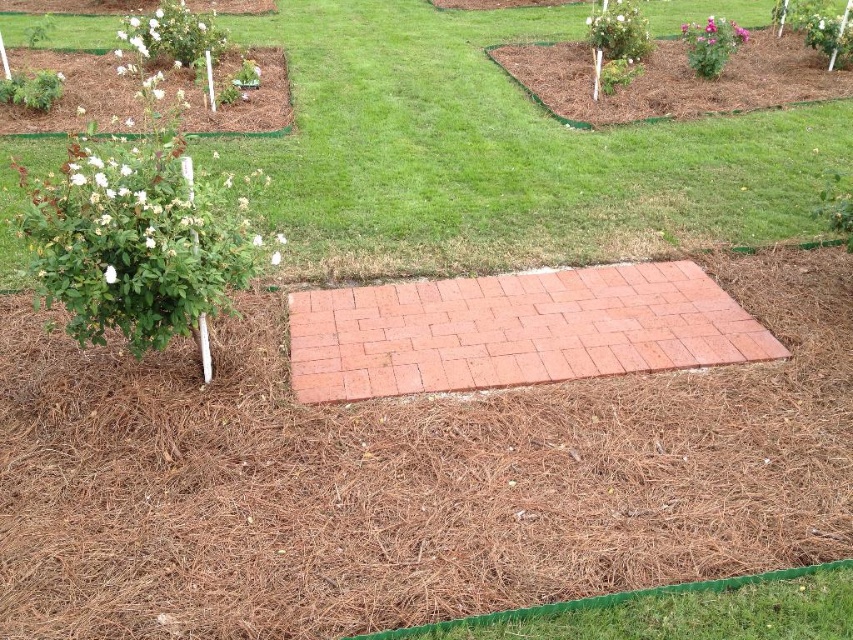
Is red brick path at center in front of white matte flower at left?

No.

Can you confirm if red brick path at center is shorter than white matte flower at left?

Incorrect, red brick path at center's height does not fall short of white matte flower at left's.

The height and width of the screenshot is (640, 853). I want to click on red brick path at center, so click(x=515, y=330).

Image resolution: width=853 pixels, height=640 pixels. I want to click on red brick path at center, so click(x=515, y=330).

Between white matte flower at left and white matte flower at lower left, which one is positioned lower?

Positioned lower is white matte flower at left.

You are a GUI agent. You are given a task and a screenshot of the screen. Output one action in this format:
    pyautogui.click(x=<x>, y=<y>)
    Task: Click on the white matte flower at left
    The height and width of the screenshot is (640, 853).
    Given the screenshot: What is the action you would take?
    pyautogui.click(x=109, y=275)

Is point (109, 266) positioned in front of point (276, 256)?

That is True.

Locate an element on the screen. white matte flower at left is located at coordinates (109, 275).

Who is more forward, [440,621] or [277,252]?

Point [440,621] is in front.

Is green grass at lower center positioned behind white matte flower at lower left?

No, it is not.

The image size is (853, 640). Identify the location of green grass at lower center. (604, 600).

Image resolution: width=853 pixels, height=640 pixels. I want to click on green grass at lower center, so click(604, 600).